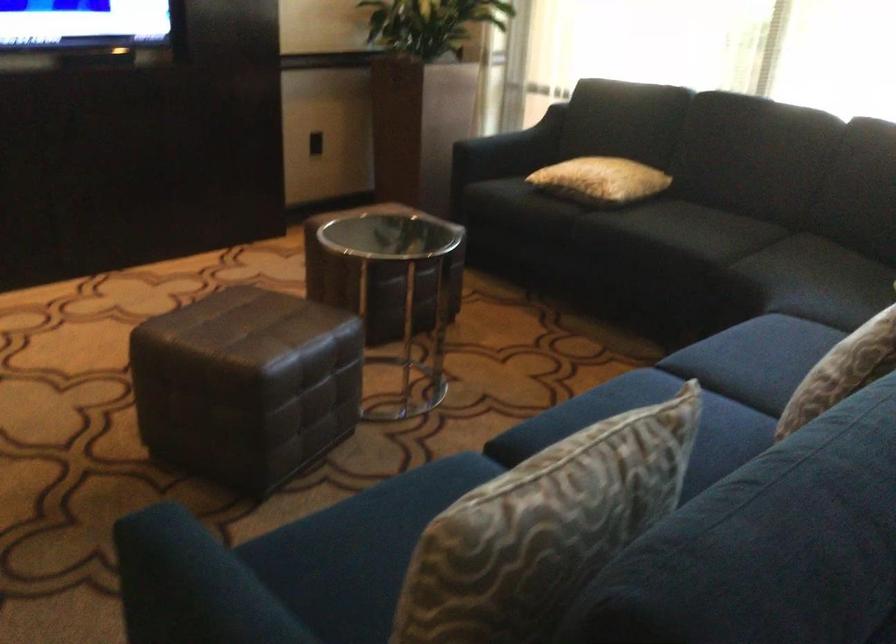
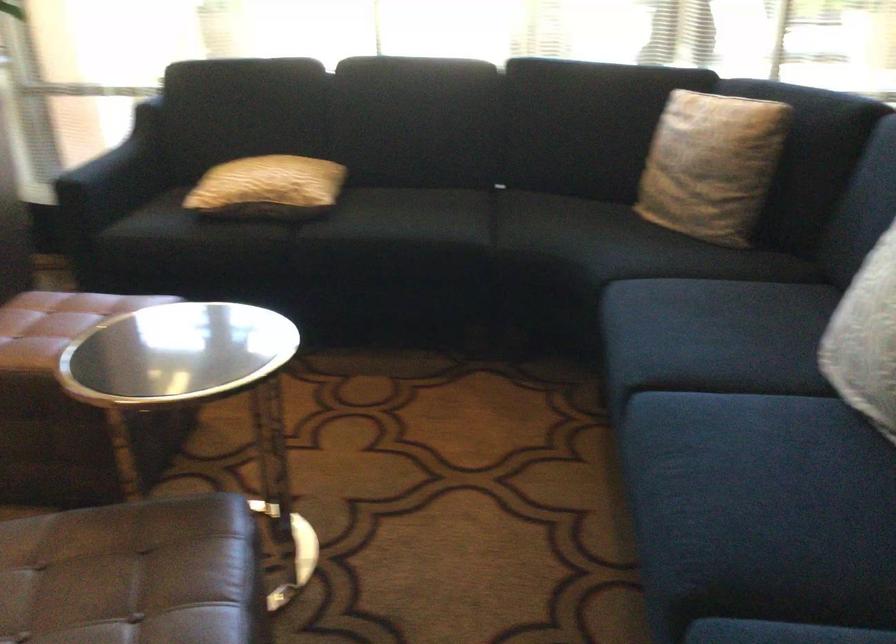
In the second image, find the point that corresponds to pixel 497 147 in the first image.

(115, 176)